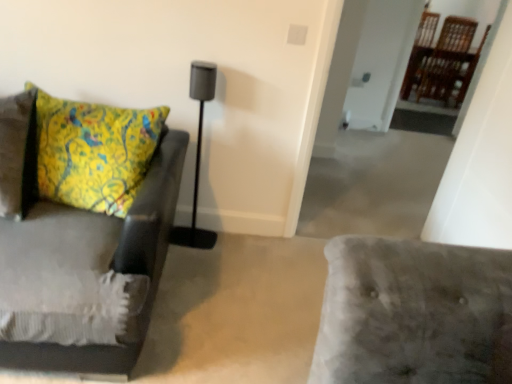
Locate an element on the screen. Image resolution: width=512 pixels, height=384 pixels. velvet gray couch at left is located at coordinates (79, 260).

What do you see at coordinates (79, 260) in the screenshot? I see `velvet gray couch at left` at bounding box center [79, 260].

The width and height of the screenshot is (512, 384). Describe the element at coordinates (198, 157) in the screenshot. I see `matte black speaker at center` at that location.

Measure the distance between matte black speaker at center and camera.

They are 6.28 feet apart.

You are a GUI agent. You are given a task and a screenshot of the screen. Output one action in this format:
    pyautogui.click(x=<x>, y=<y>)
    Task: Click on the matte black speaker at center
    
    Given the screenshot: What is the action you would take?
    pyautogui.click(x=198, y=157)

Locate an element on the screen. velvet gray couch at left is located at coordinates (79, 260).

Considering the relative positions of velvet gray couch at left and matte black speaker at center in the image provided, is velvet gray couch at left to the left of matte black speaker at center from the viewer's perspective?

Correct, you'll find velvet gray couch at left to the left of matte black speaker at center.

Relative to matte black speaker at center, is velvet gray couch at left in front or behind?

Visually, velvet gray couch at left is located in front of matte black speaker at center.

Does point (30, 121) come farther from viewer compared to point (177, 231)?

That is False.

From the picture: From the image's perspective, is velvet gray couch at left located above matte black speaker at center?

No, from the image's perspective, velvet gray couch at left is not over matte black speaker at center.

From a real-world perspective, is velvet gray couch at left physically located above or below matte black speaker at center?

From a real-world perspective, velvet gray couch at left is physically below matte black speaker at center.

In the scene shown: Can you confirm if velvet gray couch at left is thinner than matte black speaker at center?

No, velvet gray couch at left is not thinner than matte black speaker at center.

Who is taller, velvet gray couch at left or matte black speaker at center?

matte black speaker at center is taller.

Is velvet gray couch at left bigger than matte black speaker at center?

Indeed, velvet gray couch at left has a larger size compared to matte black speaker at center.

Is matte black speaker at center located within velvet gray couch at left?

No, matte black speaker at center is located outside of velvet gray couch at left.

Would you say velvet gray couch at left is a long distance from matte black speaker at center?

No.

Is velvet gray couch at left aimed at matte black speaker at center?

No, velvet gray couch at left is not aimed at matte black speaker at center.

Where is `studio couch lying on the left of matte black speaker at center`? This screenshot has width=512, height=384. studio couch lying on the left of matte black speaker at center is located at coordinates (79, 260).

Is matte black speaker at center at the left side of velvet gray couch at left?

No, matte black speaker at center is not to the left of velvet gray couch at left.

Is the position of matte black speaker at center more distant than that of velvet gray couch at left?

Yes, it is.

Is point (191, 233) positioned after point (173, 163)?

Yes, it is.

From the image's perspective, is matte black speaker at center located above velvet gray couch at left?

Yes.

From a real-world perspective, which object rests below the other?

From a 3D spatial view, velvet gray couch at left is below.

From the picture: Between matte black speaker at center and velvet gray couch at left, which one has smaller width?

With smaller width is matte black speaker at center.

Is matte black speaker at center shorter than velvet gray couch at left?

No.

In terms of size, does matte black speaker at center appear bigger or smaller than velvet gray couch at left?

matte black speaker at center is smaller than velvet gray couch at left.

Is matte black speaker at center outside of velvet gray couch at left?

Yes, matte black speaker at center is outside of velvet gray couch at left.

Are matte black speaker at center and velvet gray couch at left far apart?

matte black speaker at center is near velvet gray couch at left, not far away.

Does matte black speaker at center turn towards velvet gray couch at left?

No, matte black speaker at center does not turn towards velvet gray couch at left.

Can you tell me how much matte black speaker at center and velvet gray couch at left differ in facing direction?

0.649 degrees.

Find the location of a particular element. This screenshot has height=384, width=512. table lamp above the velvet gray couch at left (from a real-world perspective) is located at coordinates (198, 157).

Image resolution: width=512 pixels, height=384 pixels. I want to click on studio couch in front of the matte black speaker at center, so click(79, 260).

Identify the location of table lamp above the velvet gray couch at left (from a real-world perspective). The height and width of the screenshot is (384, 512). (198, 157).